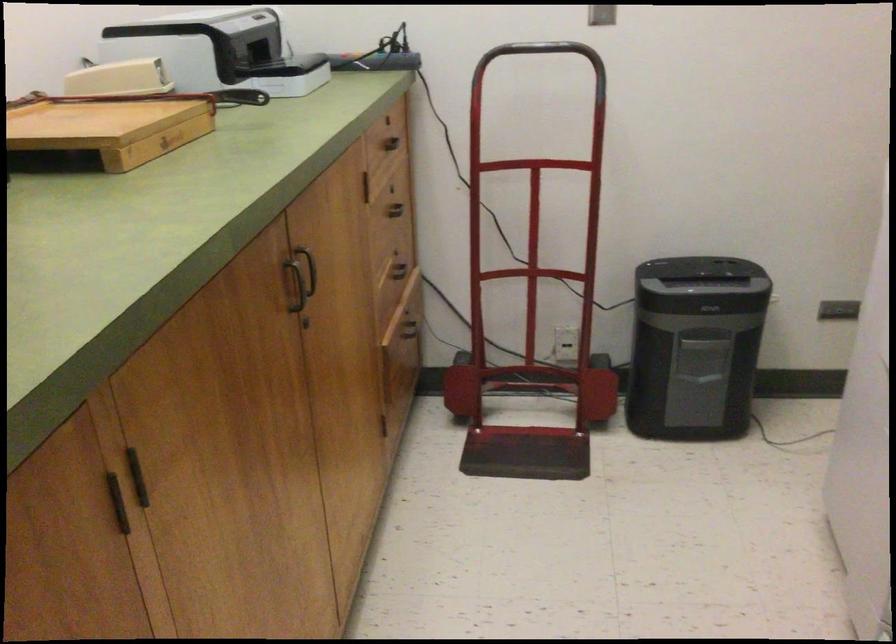
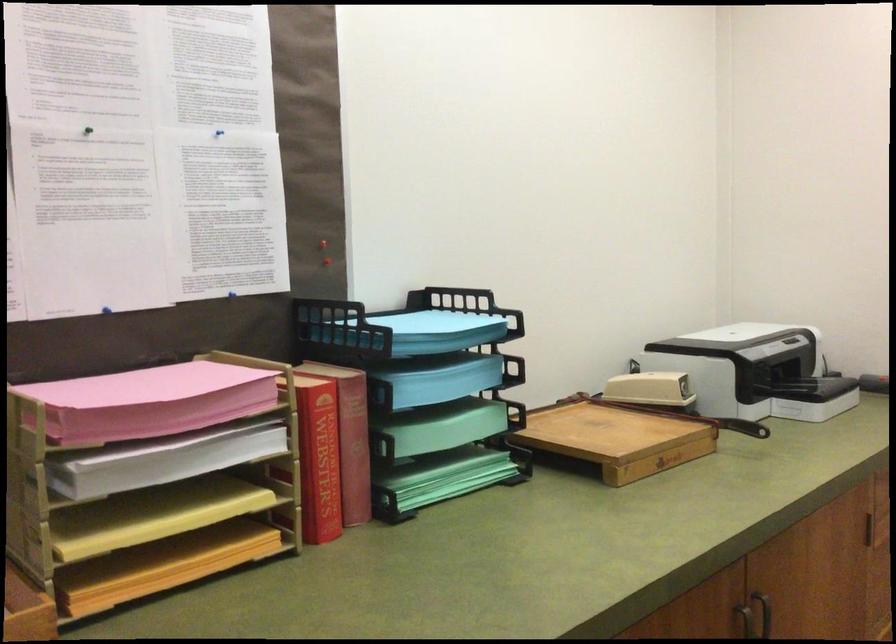
Locate, in the second image, the point that corresponds to (x=298, y=279) in the first image.

(746, 623)